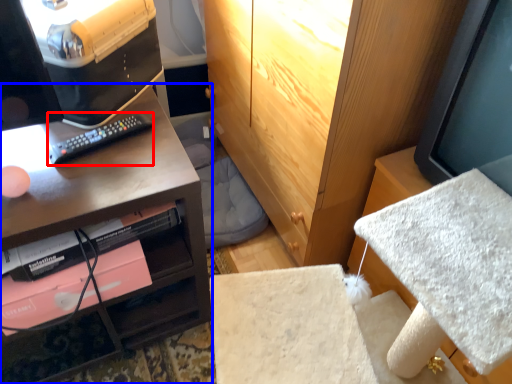
Question: Which point is further to the camera, remote (highlighted by a red box) or desk (highlighted by a blue box)?

Choices:
 (A) remote
 (B) desk

Answer: (A)